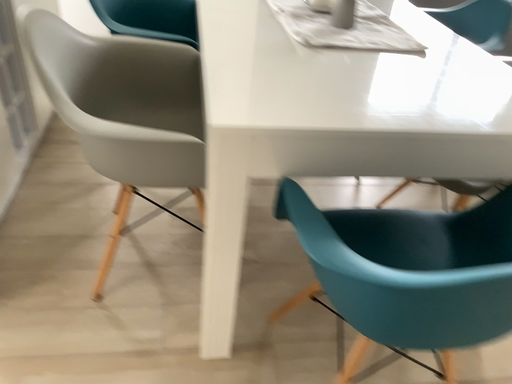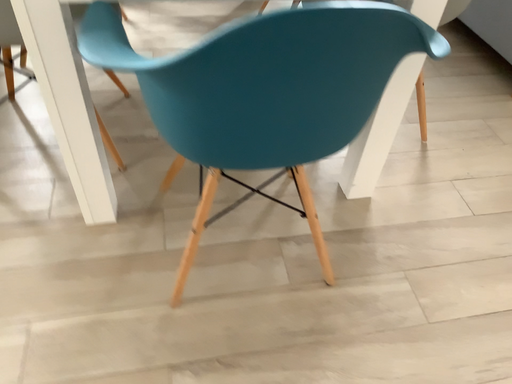
Question: How did the camera likely rotate when shooting the video?

Choices:
 (A) rotated downward
 (B) rotated upward

Answer: (A)